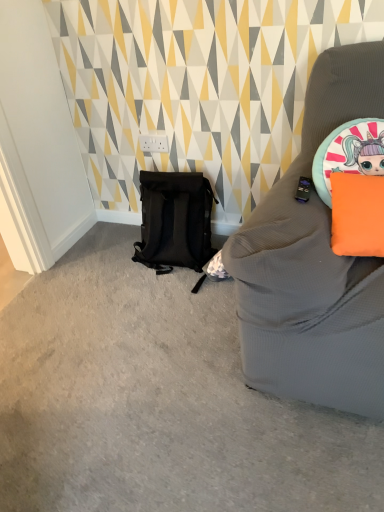
Question: From a real-world perspective, is orange matte pillow at upper right above or below black matte backpack at lower left?

Choices:
 (A) below
 (B) above

Answer: (B)

Question: From their relative heights in the image, would you say orange matte pillow at upper right is taller or shorter than black matte backpack at lower left?

Choices:
 (A) short
 (B) tall

Answer: (A)

Question: In the image, is orange matte pillow at upper right on the left side or the right side of black matte backpack at lower left?

Choices:
 (A) right
 (B) left

Answer: (A)

Question: From the image's perspective, is black matte backpack at lower left above or below orange matte pillow at upper right?

Choices:
 (A) above
 (B) below

Answer: (A)

Question: Is black matte backpack at lower left wider or thinner than orange matte pillow at upper right?

Choices:
 (A) thin
 (B) wide

Answer: (B)

Question: Is point (183, 224) positioned closer to the camera than point (362, 198)?

Choices:
 (A) farther
 (B) closer

Answer: (A)

Question: In terms of height, does black matte backpack at lower left look taller or shorter compared to orange matte pillow at upper right?

Choices:
 (A) short
 (B) tall

Answer: (B)